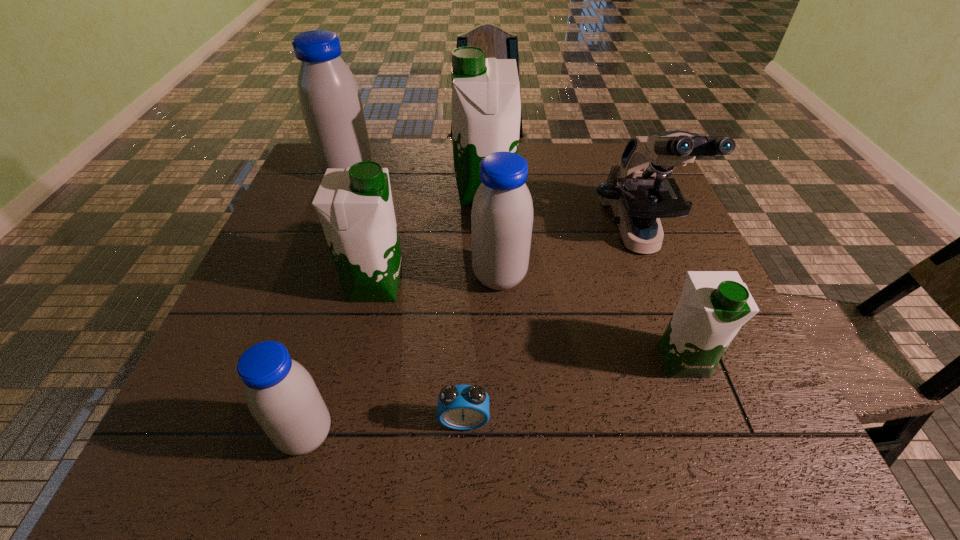
Locate an element on the screen. The width and height of the screenshot is (960, 540). free space located on the front-facing side of the nearest green soya milk is located at coordinates (703, 413).

This screenshot has height=540, width=960. I want to click on free space located 0.150m on the right of the nearest soya milk, so click(422, 434).

Where is `vacant space located on the face of the shortest object`? vacant space located on the face of the shortest object is located at coordinates (463, 467).

At what (x,y) coordinates should I click in order to perform the action: click on soya milk that is at the near edge. Please return your answer as a coordinate pair (x, y). This screenshot has width=960, height=540. Looking at the image, I should click on (281, 395).

Identify the location of alarm clock at the near edge. This screenshot has height=540, width=960. (460, 407).

The image size is (960, 540). Find the location of `object at the left edge`. object at the left edge is located at coordinates (329, 97).

This screenshot has width=960, height=540. I want to click on microscope that is at the right edge, so click(x=638, y=189).

Identify the location of soya milk located in the right edge section of the desktop. The width and height of the screenshot is (960, 540). (714, 305).

I want to click on object at the far left corner, so click(x=329, y=97).

The width and height of the screenshot is (960, 540). Find the location of `free point at the far edge`. free point at the far edge is located at coordinates (552, 164).